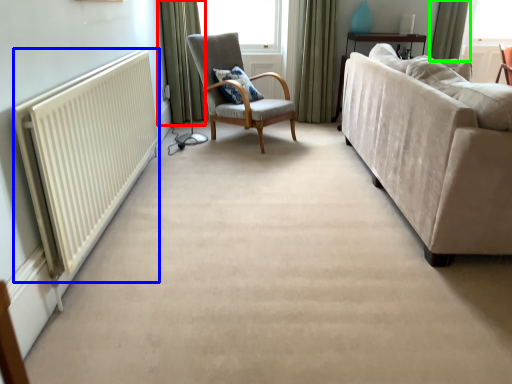
Question: Which object is the closest to the curtain (highlighted by a red box)? Choose among these: radiator (highlighted by a blue box) or curtain (highlighted by a green box).

Choices:
 (A) radiator
 (B) curtain

Answer: (A)